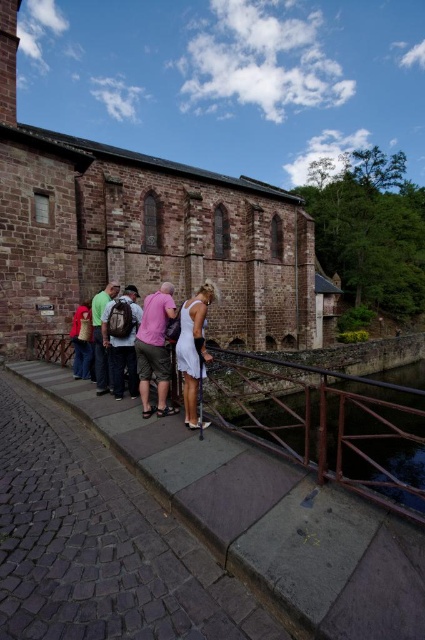
Who is higher up, dark gray backpack at center or red cotton shirt at lower left?

red cotton shirt at lower left is above.

Can you confirm if dark gray backpack at center is shorter than red cotton shirt at lower left?

In fact, dark gray backpack at center may be taller than red cotton shirt at lower left.

Does point (112, 342) come in front of point (90, 326)?

That is True.

Where is `dark gray backpack at center`? dark gray backpack at center is located at coordinates (121, 339).

Does rusty metal railing at center appear under red cotton shirt at lower left?

Indeed, rusty metal railing at center is positioned under red cotton shirt at lower left.

Does rusty metal railing at center lie in front of red cotton shirt at lower left?

Yes.

Which is in front, point (265, 371) or point (84, 330)?

Point (84, 330)

Find the location of a particular element. rusty metal railing at center is located at coordinates (326, 422).

Is white satin dress at center above green fabric shirt at center?

No.

What do you see at coordinates (193, 349) in the screenshot? This screenshot has height=640, width=425. I see `white satin dress at center` at bounding box center [193, 349].

This screenshot has height=640, width=425. Describe the element at coordinates (193, 349) in the screenshot. I see `white satin dress at center` at that location.

Where is `white satin dress at center`? white satin dress at center is located at coordinates (193, 349).